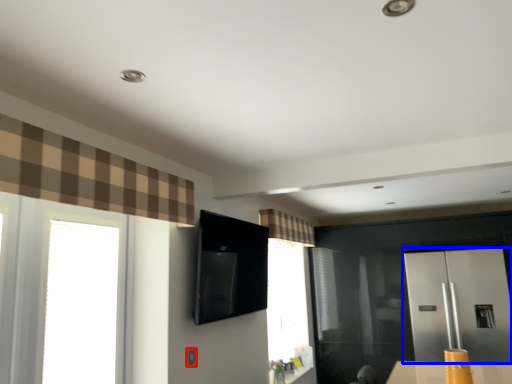
Question: Which of the following is the closest to the observer, electric outlet (highlighted by a red box) or screen door (highlighted by a blue box)?

Choices:
 (A) electric outlet
 (B) screen door

Answer: (A)